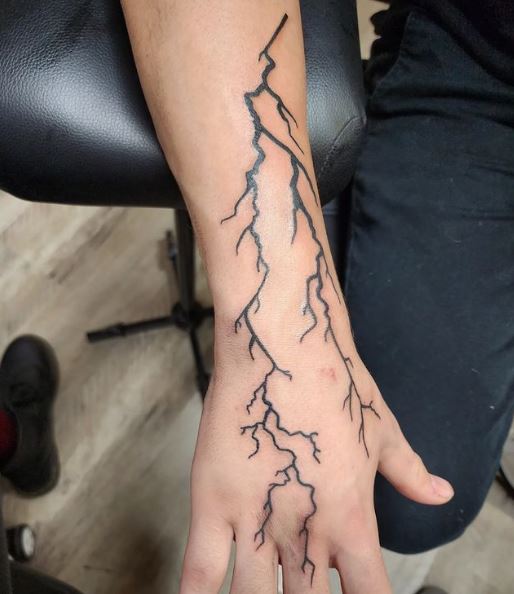
Identify the location of stand. (186, 283).